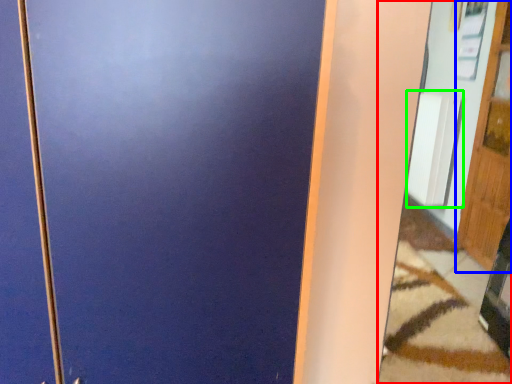
Question: Which object is the farthest from mirror (highlighted by a red box)? Choose among these: door (highlighted by a blue box) or radiator (highlighted by a green box).

Choices:
 (A) door
 (B) radiator

Answer: (B)